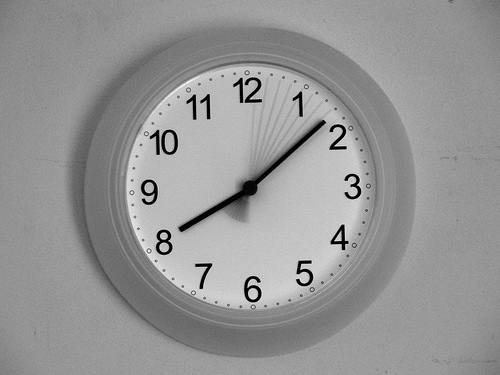
Identify the location of clock. (254, 198).